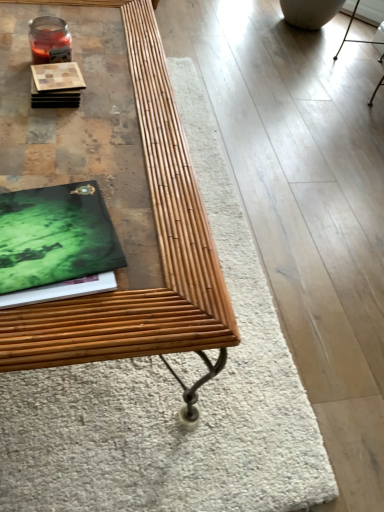
Question: From the image's perspective, is bamboo table at center located above wooden coaster at upper left?

Choices:
 (A) yes
 (B) no

Answer: (B)

Question: Does bamboo table at center lie in front of wooden coaster at upper left?

Choices:
 (A) no
 (B) yes

Answer: (B)

Question: Does bamboo table at center come behind wooden coaster at upper left?

Choices:
 (A) yes
 (B) no

Answer: (B)

Question: Is bamboo table at center beside wooden coaster at upper left?

Choices:
 (A) no
 (B) yes

Answer: (A)

Question: From a real-world perspective, is bamboo table at center on wooden coaster at upper left?

Choices:
 (A) no
 (B) yes

Answer: (A)

Question: Based on their positions, is wooden coaster at upper left located to the left or right of bamboo table at center?

Choices:
 (A) left
 (B) right

Answer: (B)

Question: Is point (51, 88) closer or farther from the camera than point (145, 36)?

Choices:
 (A) closer
 (B) farther

Answer: (A)

Question: From the image's perspective, is wooden coaster at upper left above or below bamboo table at center?

Choices:
 (A) below
 (B) above

Answer: (B)

Question: Looking at the image, does wooden coaster at upper left seem bigger or smaller compared to bamboo table at center?

Choices:
 (A) big
 (B) small

Answer: (B)

Question: Relative to wooden coaster at upper left, is green matte book at left in front or behind?

Choices:
 (A) front
 (B) behind

Answer: (A)

Question: In terms of size, does green matte book at left appear bigger or smaller than wooden coaster at upper left?

Choices:
 (A) small
 (B) big

Answer: (B)

Question: Is green matte book at left to the left or to the right of wooden coaster at upper left in the image?

Choices:
 (A) right
 (B) left

Answer: (A)

Question: From the image's perspective, relative to wooden coaster at upper left, is green matte book at left above or below?

Choices:
 (A) below
 (B) above

Answer: (A)

Question: From a real-world perspective, relative to green matte book at left, is bamboo table at center vertically above or below?

Choices:
 (A) below
 (B) above

Answer: (A)

Question: From their relative heights in the image, would you say bamboo table at center is taller or shorter than green matte book at left?

Choices:
 (A) short
 (B) tall

Answer: (B)